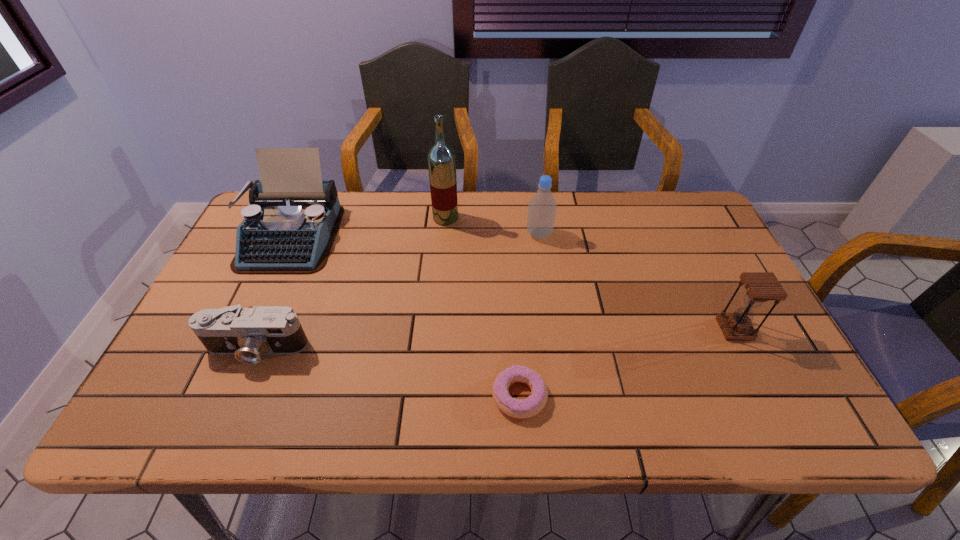
The height and width of the screenshot is (540, 960). I want to click on empty space between the typewriter and the liquor, so click(x=368, y=227).

The height and width of the screenshot is (540, 960). What are the coordinates of `vacant area between the second shortest object and the fourth tallest object` in the screenshot? It's located at (495, 339).

Image resolution: width=960 pixels, height=540 pixels. I want to click on free space between the typewriter and the liquor, so click(368, 227).

Where is `free space between the nearest object and the typewriter`? Image resolution: width=960 pixels, height=540 pixels. free space between the nearest object and the typewriter is located at coordinates (405, 316).

Find the location of `vacant region between the typewriter and the shortest object`. vacant region between the typewriter and the shortest object is located at coordinates (405, 316).

The height and width of the screenshot is (540, 960). I want to click on free space between the nearest object and the camera, so click(x=388, y=373).

Identify the location of unoccupied position between the tallest object and the bottle. (492, 226).

The height and width of the screenshot is (540, 960). In order to click on unoccupied position between the shortest object and the camera in this screenshot , I will do `click(388, 373)`.

The width and height of the screenshot is (960, 540). Identify the location of vacant area that lies between the nearest object and the rightmost object. (627, 362).

At what (x,y) coordinates should I click in order to perform the action: click on the fifth closest object to the doughnut. Please return your answer as a coordinate pair (x, y). This screenshot has height=540, width=960. Looking at the image, I should click on (289, 227).